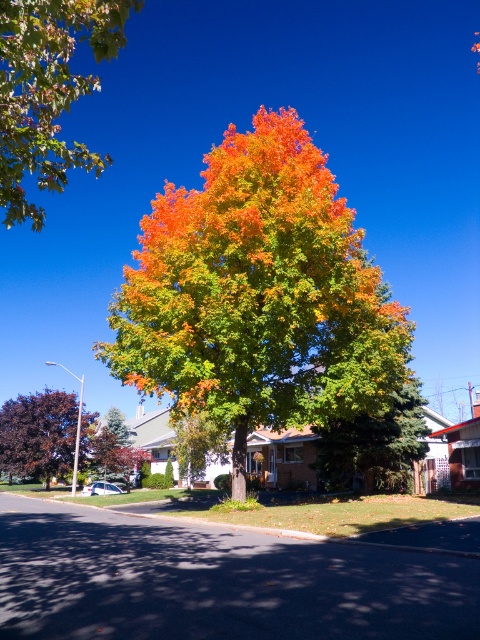
Which of these two, vivid orange leaves at center or purple glossy tree at left, stands taller?

With more height is vivid orange leaves at center.

Is vivid orange leaves at center in front of purple glossy tree at left?

Yes, vivid orange leaves at center is closer to the viewer.

Where is `vivid orange leaves at center`? vivid orange leaves at center is located at coordinates (257, 294).

Between point (410, 397) and point (47, 456), which one is positioned in front?

Positioned in front is point (410, 397).

Based on the photo, can you confirm if green matte tree at center is smaller than purple glossy tree at left?

Yes, green matte tree at center is smaller than purple glossy tree at left.

Who is more distant from viewer, [397,456] or [36,394]?

The point [36,394] is more distant.

Identify the location of green matte tree at center. (373, 445).

Who is positioned more to the left, green matte leaves at upper left or green matte tree at center?

Positioned to the left is green matte leaves at upper left.

Looking at this image, can you confirm if green matte leaves at upper left is positioned to the right of green matte tree at center?

Incorrect, green matte leaves at upper left is not on the right side of green matte tree at center.

Does point (37, 209) come behind point (414, 410)?

No, (37, 209) is closer to viewer.

This screenshot has height=640, width=480. Find the location of `green matte leaves at upper left`. green matte leaves at upper left is located at coordinates (48, 90).